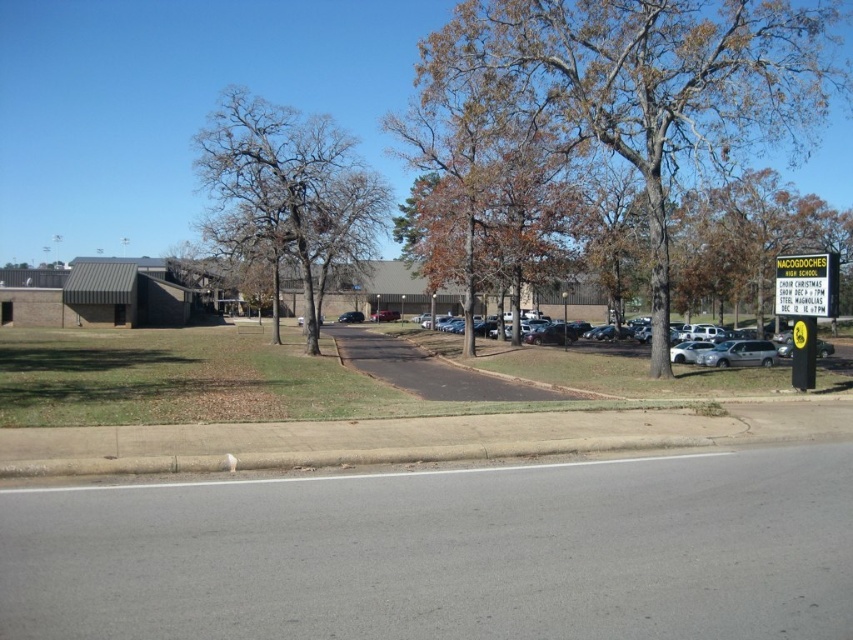
Question: Which is nearer to the bare branches at left?

Choices:
 (A) silver metallic sedan at center
 (B) yellow plastic sign at right

Answer: (A)

Question: Is bare branches at left below yellow plastic sign at right?

Choices:
 (A) yes
 (B) no

Answer: (B)

Question: Is bare branches at left smaller than silver metallic sedan at center?

Choices:
 (A) yes
 (B) no

Answer: (B)

Question: Which point is closer to the camera?

Choices:
 (A) bare branches at left
 (B) silver metallic sedan at center
 (C) yellow plastic sign at right

Answer: (C)

Question: Is bare branches at left positioned at the back of yellow plastic sign at right?

Choices:
 (A) yes
 (B) no

Answer: (A)

Question: Considering the real-world distances, which object is closest to the brown leafy tree at center?

Choices:
 (A) silver metallic sedan at center
 (B) bare branches at left
 (C) yellow plastic sign at right

Answer: (A)